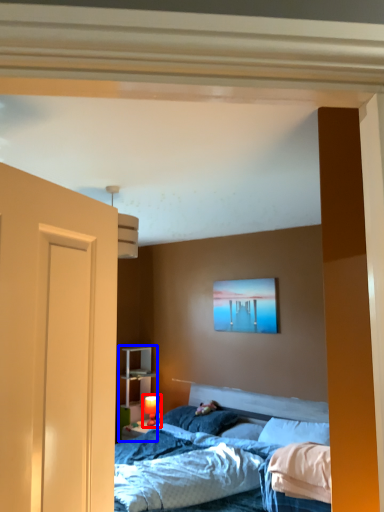
Question: Which object appears closest to the camera in this image, table lamp (highlighted by a red box) or dresser (highlighted by a blue box)?

Choices:
 (A) table lamp
 (B) dresser

Answer: (A)